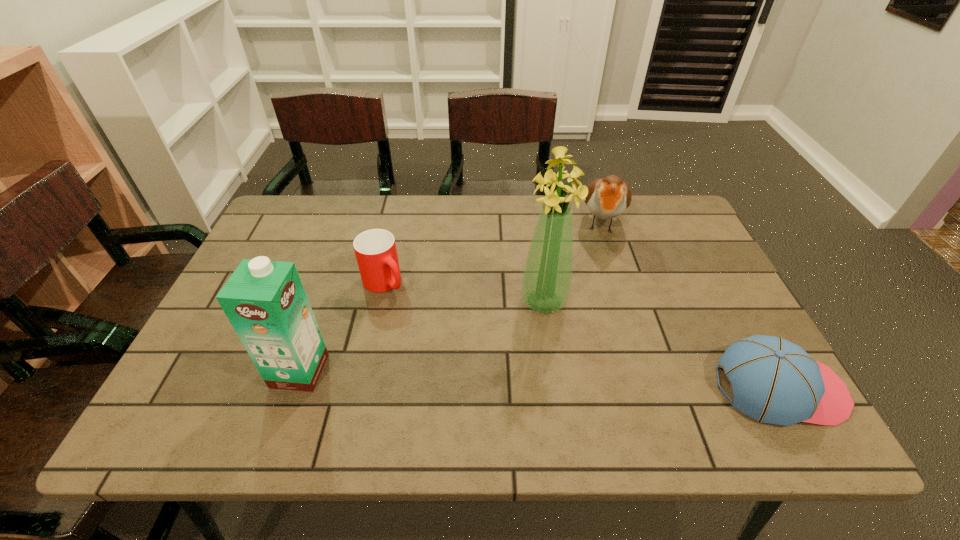
Identify the location of blank area located 0.390m at the face of the farthest object. (599, 354).

Identify the location of vacant space located 0.110m at the face of the farthest object. point(602,272).

Identify the location of free space located on the front-facing side of the third object from left to right. Image resolution: width=960 pixels, height=540 pixels. (571, 381).

Locate an element on the screen. vacant area located on the front-facing side of the third object from left to right is located at coordinates (575, 393).

The image size is (960, 540). What are the coordinates of `free location located on the front-facing side of the third object from left to right` in the screenshot? It's located at (564, 359).

This screenshot has width=960, height=540. What are the coordinates of `vacant position located 0.260m on the side of the fourth object from right to left with the handle` in the screenshot? It's located at (462, 355).

In order to click on vacant area situated on the side of the fourth object from right to left with the handle in this screenshot , I will do `click(438, 332)`.

You are a GUI agent. You are given a task and a screenshot of the screen. Output one action in this format:
    pyautogui.click(x=<x>, y=<y>)
    Task: Click on the free location located on the side of the fourth object from right to left with the handle
    
    Given the screenshot: What is the action you would take?
    pyautogui.click(x=441, y=334)

I want to click on object present at the far edge, so click(607, 198).

At what (x,y) coordinates should I click in order to perform the action: click on carton present at the near edge. Please return your answer as a coordinate pair (x, y). Looking at the image, I should click on (265, 301).